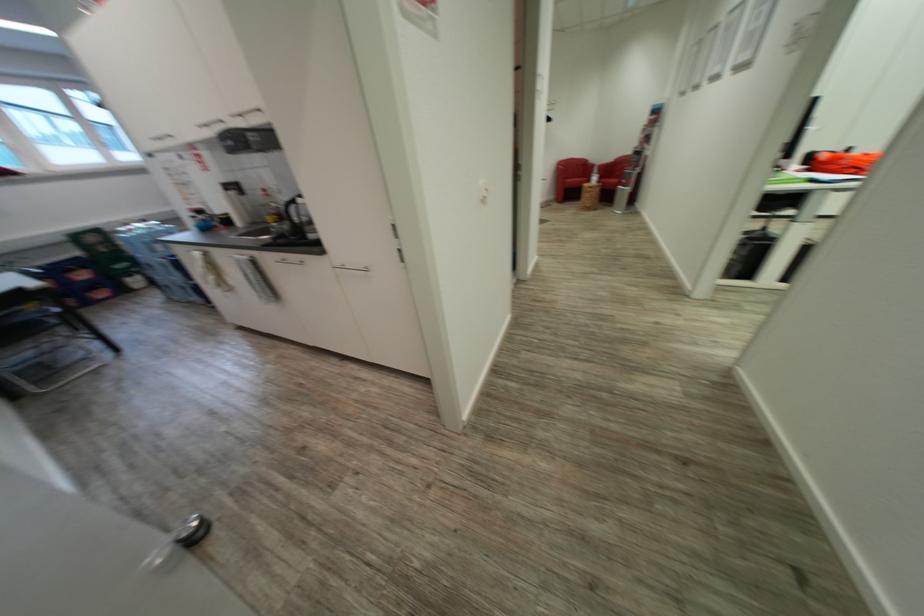
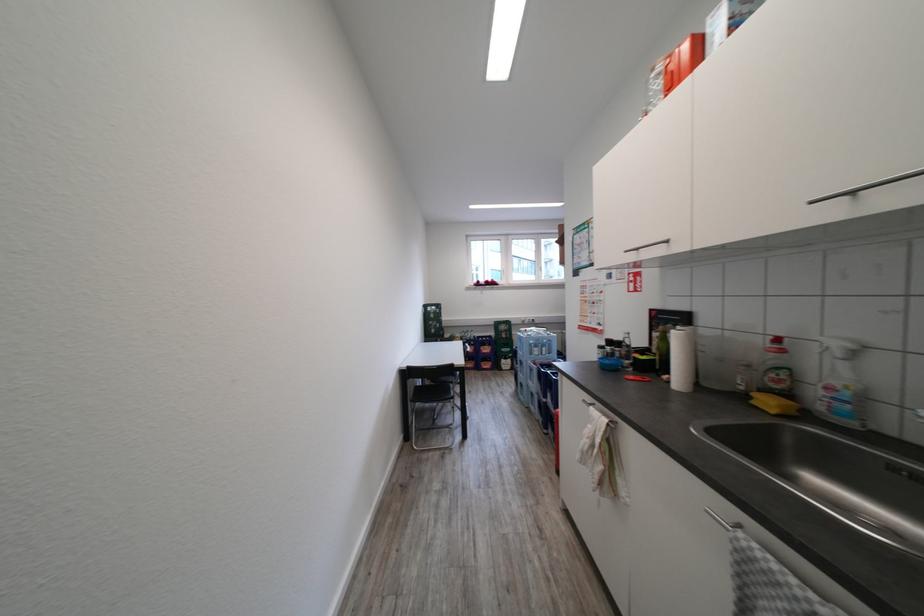
Locate, in the second image, the point that corresponds to point (204, 254) in the first image.

(611, 426)